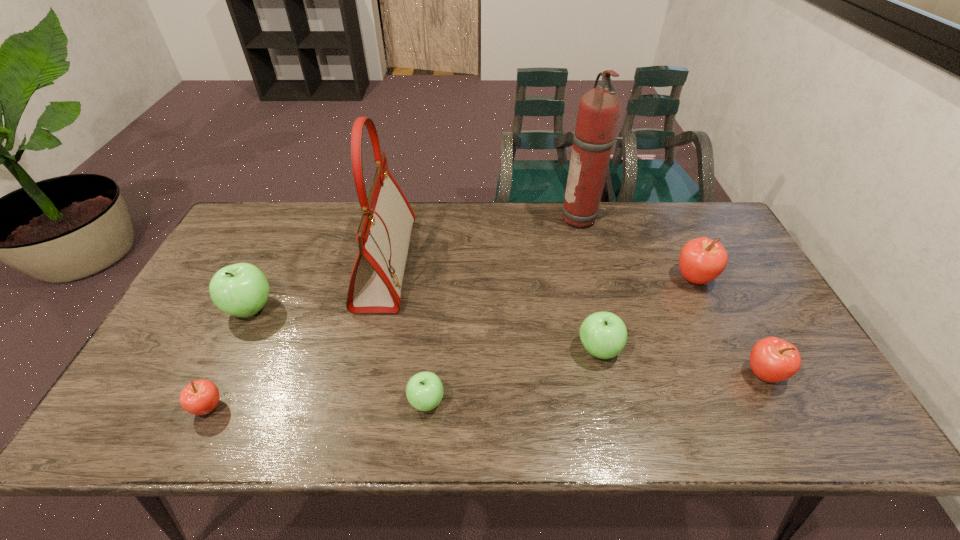
This screenshot has width=960, height=540. In order to click on fire extinguisher in this screenshot , I will do `click(599, 109)`.

Where is `the third object from left to right`? the third object from left to right is located at coordinates (383, 234).

Where is `handbag`? Image resolution: width=960 pixels, height=540 pixels. handbag is located at coordinates (383, 234).

This screenshot has width=960, height=540. Identify the location of the biggest pink apple. 701,260.

Find the location of a particular element. The height and width of the screenshot is (540, 960). the farthest green apple is located at coordinates (241, 290).

Find the location of a particular element. This screenshot has width=960, height=540. the leftmost green apple is located at coordinates (241, 290).

Identify the location of the second farthest green apple. (603, 334).

Where is `the third apple from right to left`? This screenshot has width=960, height=540. the third apple from right to left is located at coordinates (603, 334).

Locate an element on the screen. This screenshot has width=960, height=540. the second smallest pink apple is located at coordinates (772, 359).

The width and height of the screenshot is (960, 540). In order to click on the leftmost pink apple in this screenshot , I will do `click(200, 397)`.